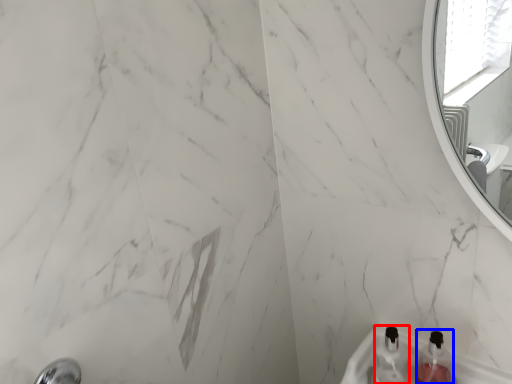
Question: Which point is closer to the camera, bottle (highlighted by a red box) or bottle (highlighted by a blue box)?

Choices:
 (A) bottle
 (B) bottle

Answer: (B)